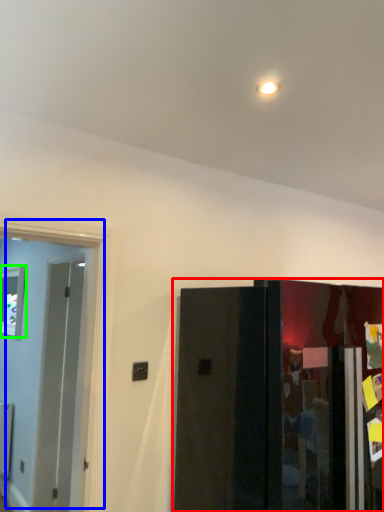
Question: Estimate the real-world distances between objects in this image. Which object is farther from door (highlighted by a red box), door (highlighted by a blue box) or window (highlighted by a green box)?

Choices:
 (A) door
 (B) window

Answer: (B)